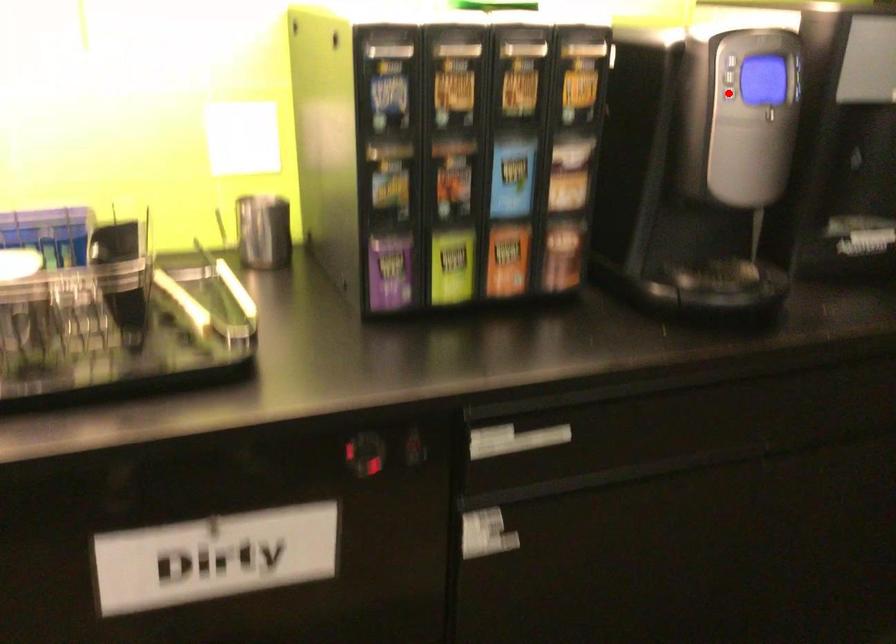
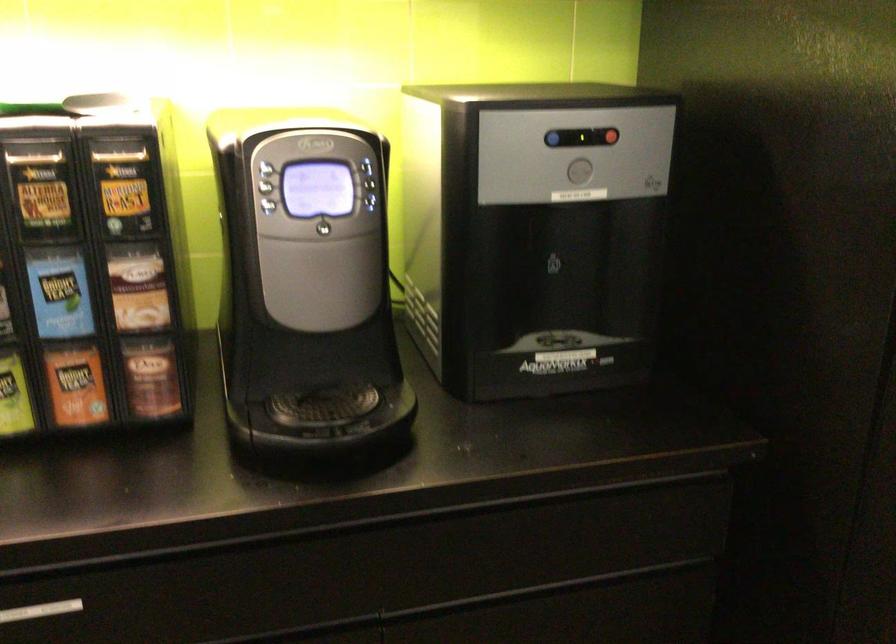
Question: I am providing you with two images of the same scene from different viewpoints. Image1 has a red point marked. In image2, the corresponding 3D location appears at what relative position? Reply with the corresponding letter.

Choices:
 (A) Closer
 (B) Farther

Answer: (A)